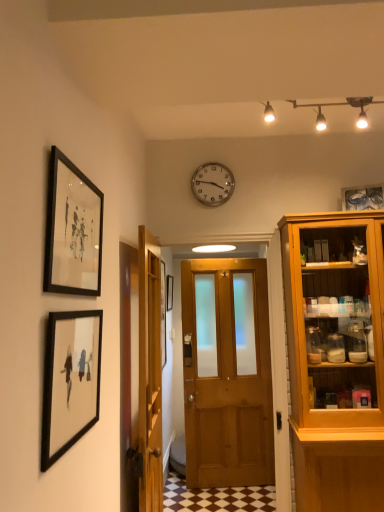
Question: Is there a large distance between silver metallic clock at upper center and black matte picture frame at lower left, the 4th picture frame viewed from the back?

Choices:
 (A) no
 (B) yes

Answer: (B)

Question: From the image's perspective, does silver metallic clock at upper center appear higher than black matte picture frame at lower left, arranged as the first picture frame when viewed from the front?

Choices:
 (A) no
 (B) yes

Answer: (B)

Question: Does silver metallic clock at upper center have a smaller size compared to black matte picture frame at lower left, arranged as the first picture frame when viewed from the front?

Choices:
 (A) yes
 (B) no

Answer: (A)

Question: Could you tell me if silver metallic clock at upper center is turned towards black matte picture frame at lower left, the 4th picture frame viewed from the back?

Choices:
 (A) yes
 (B) no

Answer: (B)

Question: From the image's perspective, is silver metallic clock at upper center located beneath black matte picture frame at lower left, the 4th picture frame viewed from the back?

Choices:
 (A) yes
 (B) no

Answer: (B)

Question: Is wooden door at center, the second door positioned from the right, in front of or behind black matte picture frame at center, the 4th picture frame when ordered from front to back, in the image?

Choices:
 (A) front
 (B) behind

Answer: (A)

Question: Considering the positions of wooden door at center, which is the first door in left-to-right order, and black matte picture frame at center, the 4th picture frame when ordered from front to back, in the image, is wooden door at center, which is the first door in left-to-right order, bigger or smaller than black matte picture frame at center, the 4th picture frame when ordered from front to back,?

Choices:
 (A) small
 (B) big

Answer: (B)

Question: Is wooden door at center, which is the first door in left-to-right order, situated inside black matte picture frame at center, which is the 1th picture frame in back-to-front order, or outside?

Choices:
 (A) outside
 (B) inside

Answer: (A)

Question: Is wooden door at center, which is the first door in left-to-right order, taller or shorter than black matte picture frame at center, marked as the 2th picture frame in a right-to-left arrangement?

Choices:
 (A) short
 (B) tall

Answer: (B)

Question: Considering the positions of silver metallic clock at upper center and black matte picture frame at center, which is the 1th picture frame in back-to-front order, in the image, is silver metallic clock at upper center wider or thinner than black matte picture frame at center, which is the 1th picture frame in back-to-front order,?

Choices:
 (A) wide
 (B) thin

Answer: (B)

Question: Is silver metallic clock at upper center spatially inside black matte picture frame at center, the third picture frame when ordered from left to right, or outside of it?

Choices:
 (A) inside
 (B) outside

Answer: (B)

Question: Is point (230, 189) closer or farther from the camera than point (167, 289)?

Choices:
 (A) farther
 (B) closer

Answer: (B)

Question: From a real-world perspective, is silver metallic clock at upper center physically located above or below black matte picture frame at center, marked as the 2th picture frame in a right-to-left arrangement?

Choices:
 (A) below
 (B) above

Answer: (B)

Question: Would you say wooden door at center, the 1th door positioned from the right, is to the left or to the right of white glossy track lights at upper center in the picture?

Choices:
 (A) right
 (B) left

Answer: (B)

Question: From a real-world perspective, is wooden door at center, the 2th door positioned from the left, above or below white glossy track lights at upper center?

Choices:
 (A) above
 (B) below

Answer: (B)